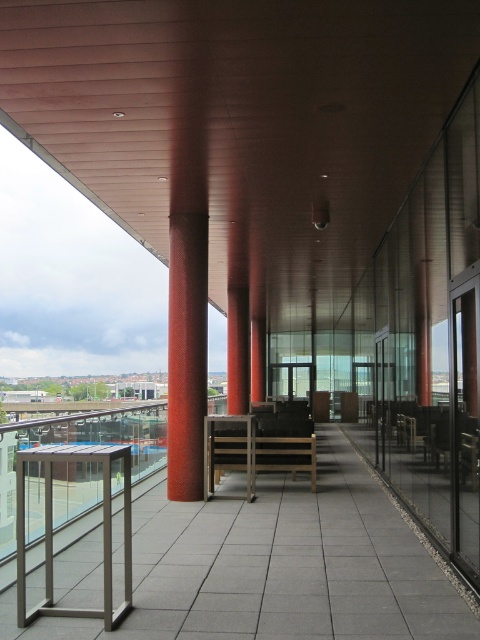
You are standing on the indoor balcony and want to locate the red textured column at center. According to the coordinates provided, where should you look? Is it closer to the left, right, top, or bottom of the image?

The red textured column at center is located at coordinates point (187, 355), which places it closer to the bottom of the image.

You are a delivery robot with a package that needs to be placed between the red textured column at center and the silver metallic balustrade at lower left. The package requires 4 meters of space to fit. Is there enough space between them?

The red textured column at center is 4.05 meters from the silver metallic balustrade at lower left, so yes, there is enough space to fit the package between them since the distance is slightly more than required.

You are standing on the indoor balcony and want to move from the silver metallic balustrade at lower left to the red textured column at center. Which direction should you move to reach it?

You should move to the right to reach the red textured column at center since it is positioned on the right side of the silver metallic balustrade at lower left.